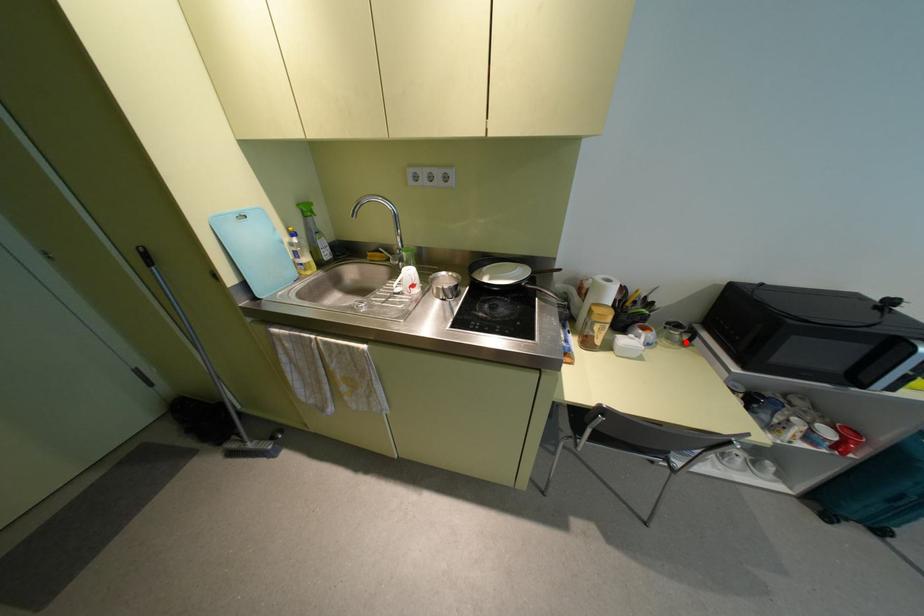
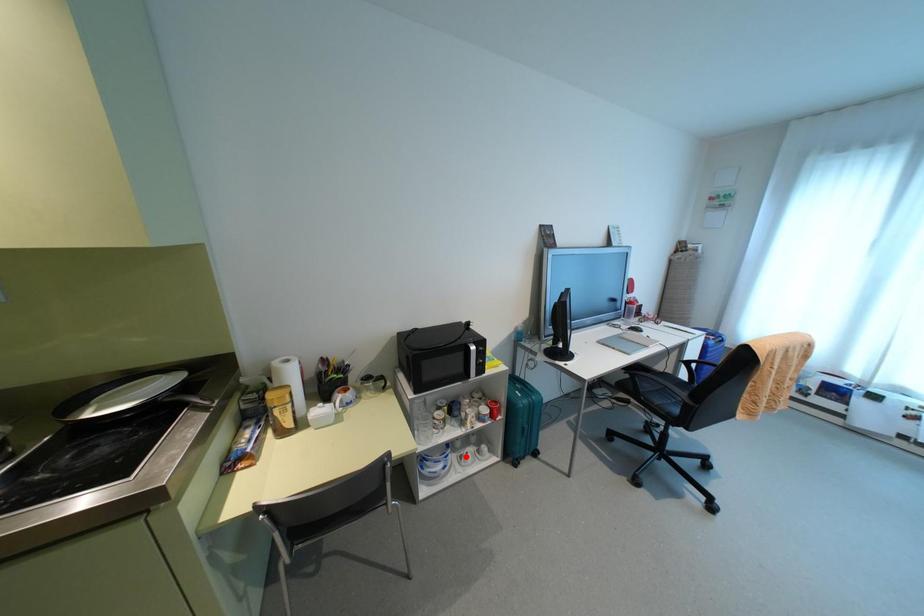
I am providing you with two images of the same scene from different viewpoints. A red point is marked on the first image and another point is marked on the second image. Is the marked point in image1 the same physical position as the marked point in image2?

No